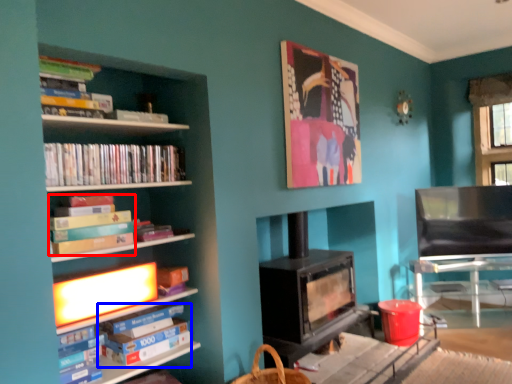
Question: Which object appears farthest to the camera in this image, book (highlighted by a red box) or paperback book (highlighted by a blue box)?

Choices:
 (A) book
 (B) paperback book

Answer: (B)